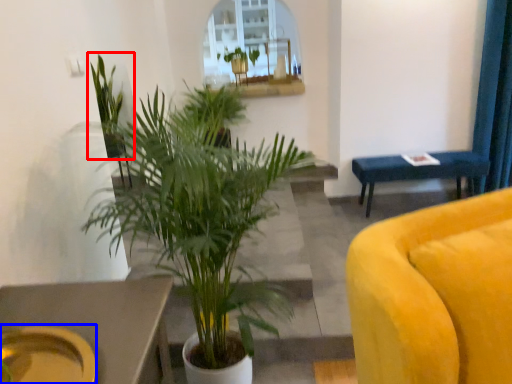
Question: Which object is closer to the camera taking this photo, houseplant (highlighted by a red box) or platter (highlighted by a blue box)?

Choices:
 (A) houseplant
 (B) platter

Answer: (B)